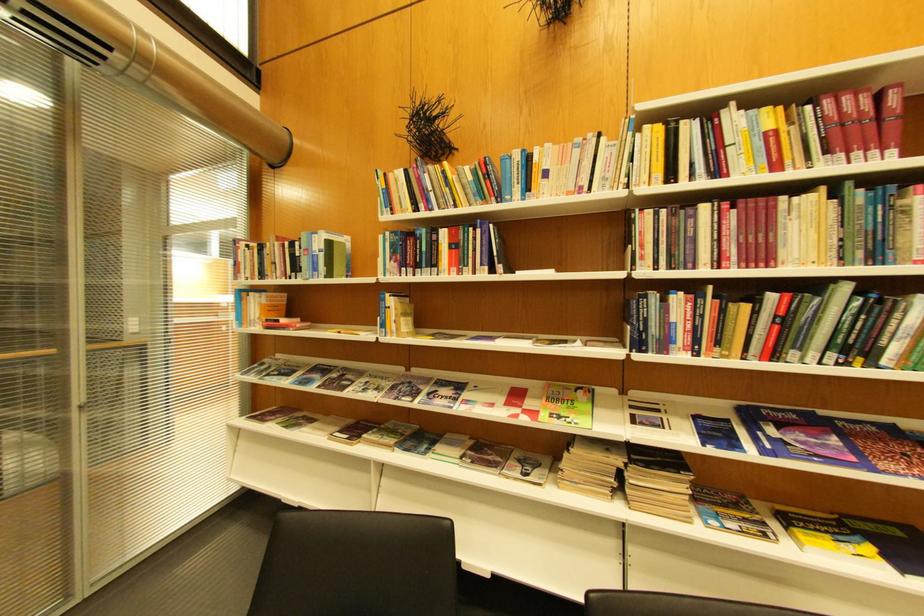
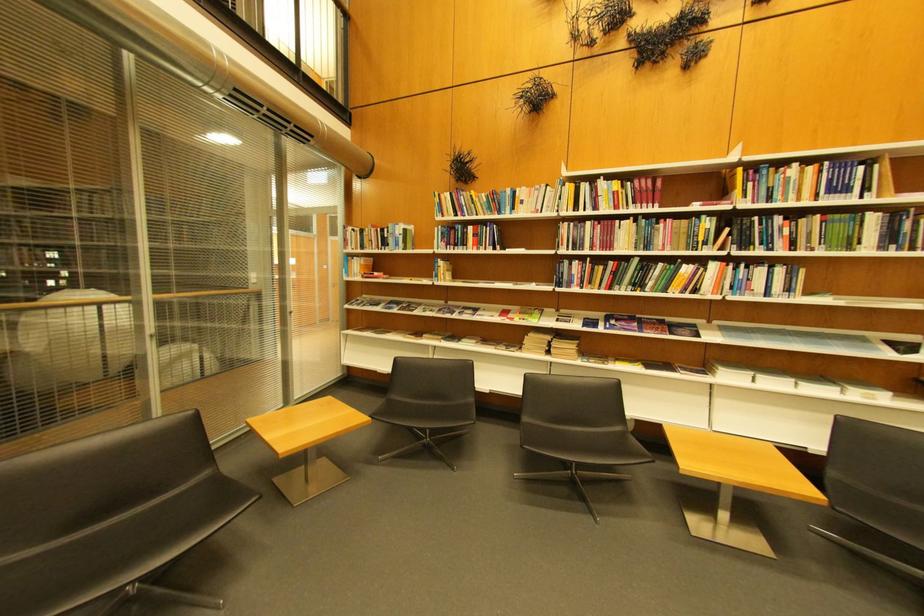
Where in the second image is the point corresponding to the point at 715,209 from the first image?

(600, 225)